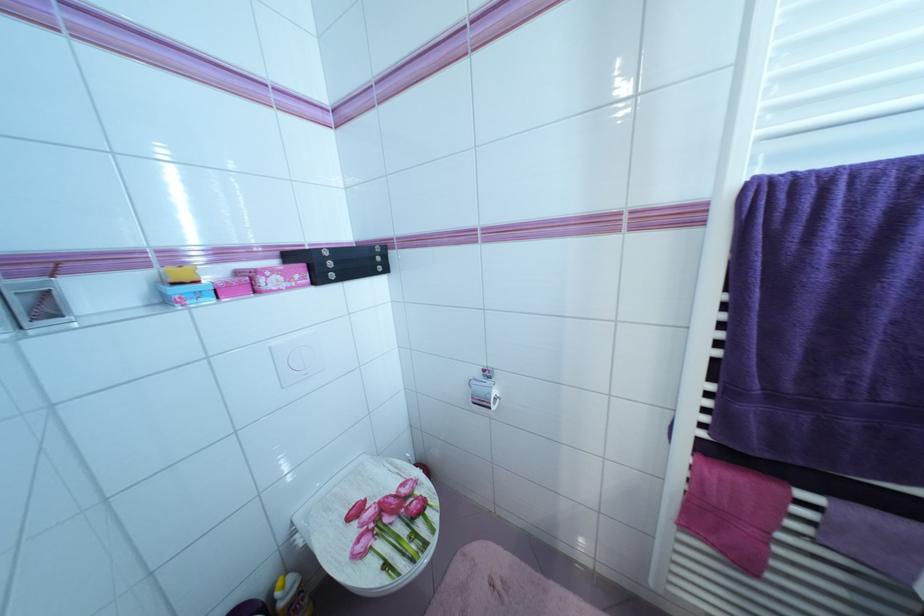
Where would you push the toilet flush button? Please return your answer as a coordinate pair (x, y).

(297, 359)